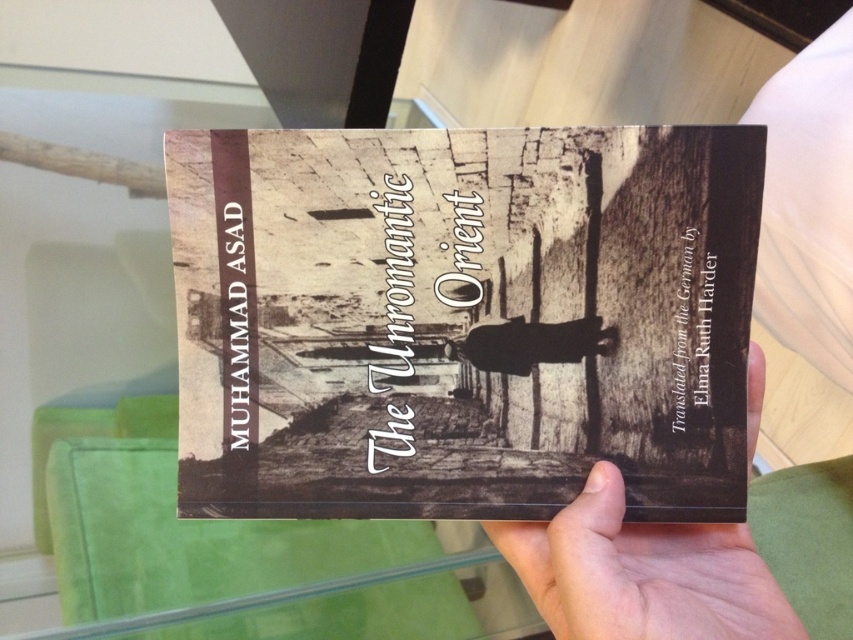
Question: Which point appears farthest from the camera in this image?

Choices:
 (A) (758, 364)
 (B) (480, 472)

Answer: (A)

Question: Is sepia-toned paper book at center smaller than smooth skin hand at center?

Choices:
 (A) yes
 (B) no

Answer: (B)

Question: Which object appears farthest from the camera in this image?

Choices:
 (A) smooth skin hand at center
 (B) sepia-toned paper book at center

Answer: (B)

Question: Is sepia-toned paper book at center wider than smooth skin hand at center?

Choices:
 (A) no
 (B) yes

Answer: (B)

Question: Can you confirm if sepia-toned paper book at center is thinner than smooth skin hand at center?

Choices:
 (A) no
 (B) yes

Answer: (A)